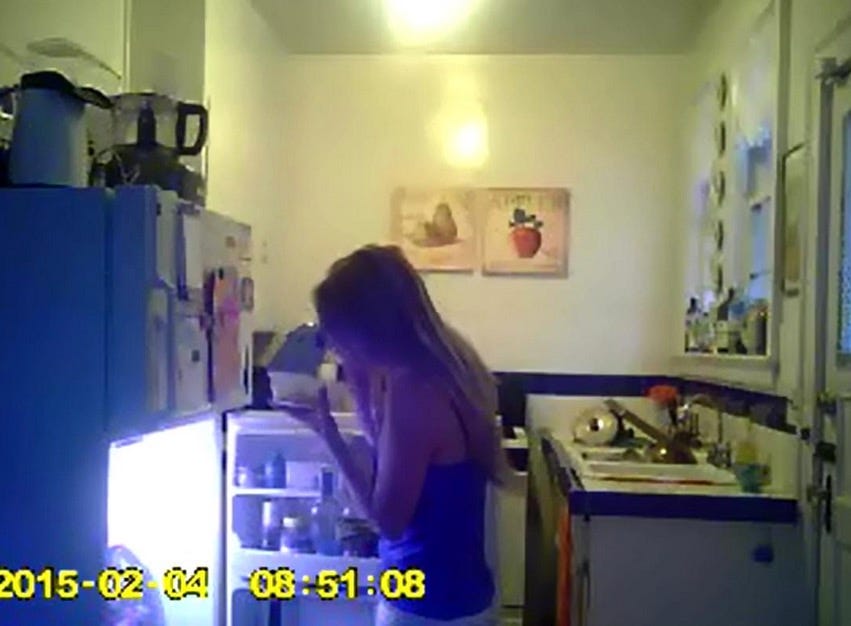
Locate an element on the screen. The height and width of the screenshot is (626, 851). sink is located at coordinates (670, 470).